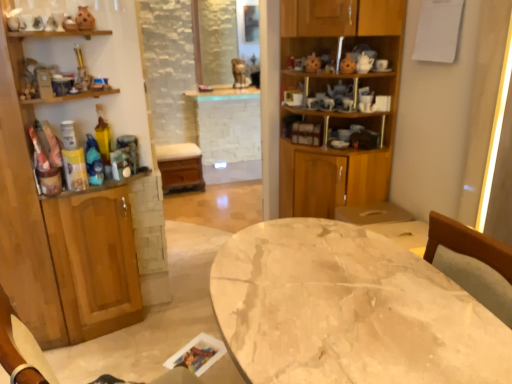
This screenshot has width=512, height=384. Identify the location of free location above marble table at center (from a real-world perspective). (309, 271).